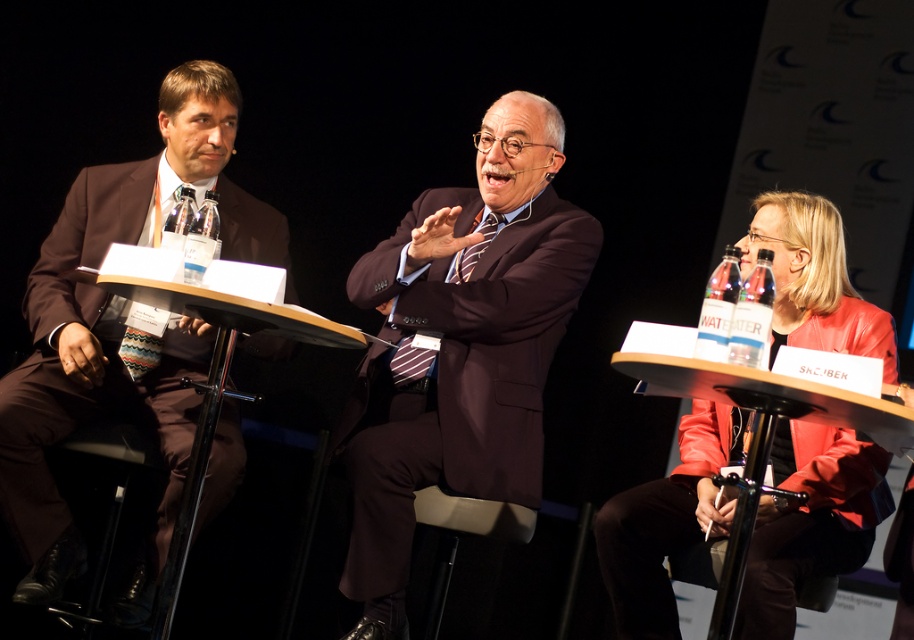
Question: Which point appears farthest from the camera in this image?

Choices:
 (A) (225, 301)
 (B) (838, 509)
 (C) (396, 545)

Answer: (C)

Question: Which of the following is the farthest from the observer?

Choices:
 (A) (692, 444)
 (B) (417, 248)
 (C) (166, 161)

Answer: (C)

Question: Does dark brown suit at center have a greater width compared to brown suit at left?

Choices:
 (A) no
 (B) yes

Answer: (B)

Question: Which object is closer to the camera taking this photo?

Choices:
 (A) wooden table at left
 (B) dark brown suit at center
 (C) brown suit at left

Answer: (A)

Question: Is dark brown suit at center behind leather jacket at right?

Choices:
 (A) yes
 (B) no

Answer: (A)

Question: From the image, what is the correct spatial relationship of brown suit at left in relation to leather jacket at right?

Choices:
 (A) above
 (B) below

Answer: (A)